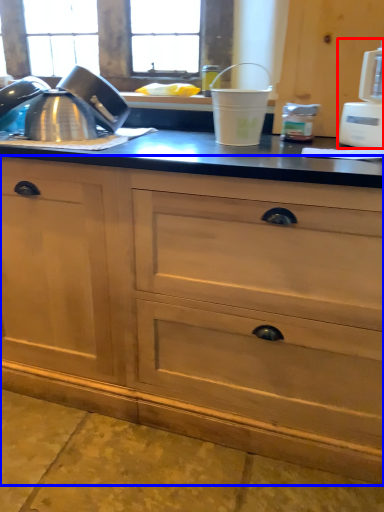
Question: Which object is further to the camera taking this photo, appliance (highlighted by a red box) or cabinetry (highlighted by a blue box)?

Choices:
 (A) appliance
 (B) cabinetry

Answer: (A)